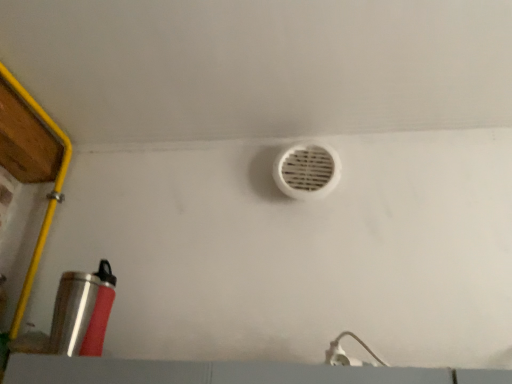
Find the location of a particular element. This screenshot has height=384, width=512. white plastic vent at upper center is located at coordinates (307, 171).

What do you see at coordinates (307, 171) in the screenshot? I see `white plastic vent at upper center` at bounding box center [307, 171].

The width and height of the screenshot is (512, 384). What are the coordinates of `white plastic vent at upper center` in the screenshot? It's located at (307, 171).